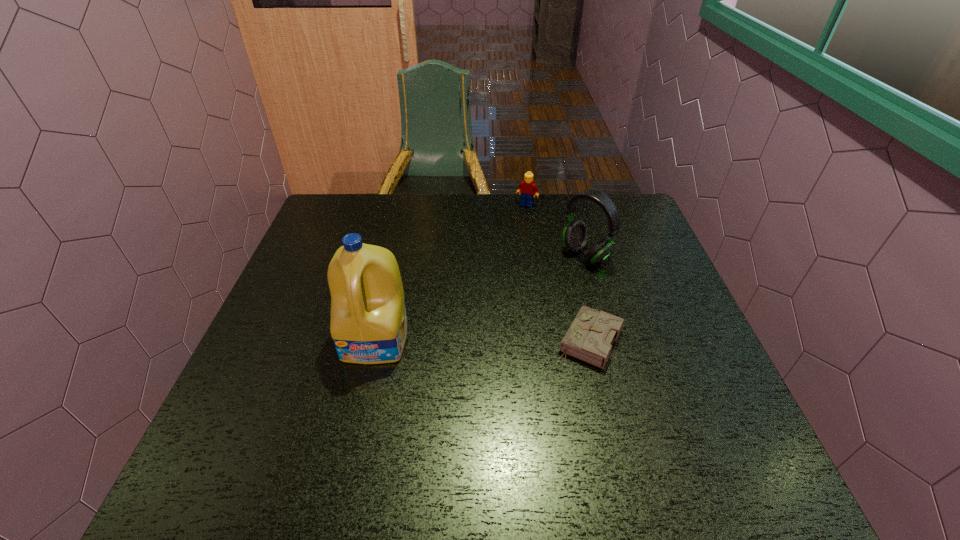
You are a GUI agent. You are given a task and a screenshot of the screen. Output one action in this format:
    pyautogui.click(x=<x>, y=<y>)
    Task: Click on the vacant area between the tallest object and the second shortest object
    This screenshot has height=540, width=960.
    Given the screenshot: What is the action you would take?
    pyautogui.click(x=451, y=272)

You are a GUI agent. You are given a task and a screenshot of the screen. Output one action in this format:
    pyautogui.click(x=<x>, y=<y>)
    Task: Click on the free space between the shortest object and the detergent
    The image size is (960, 540).
    Given the screenshot: What is the action you would take?
    pyautogui.click(x=483, y=340)

Where is `empty space that is in between the tallest object and the diary`? empty space that is in between the tallest object and the diary is located at coordinates (483, 340).

Where is `free space between the third nearest object and the Lego`? The width and height of the screenshot is (960, 540). free space between the third nearest object and the Lego is located at coordinates (556, 230).

Identify which object is located as the second nearest to the headset. Please provide its 2D coordinates. Your answer should be formatted as a tuple, i.e. [(x, y)], where the tuple contains the x and y coordinates of a point satisfying the conditions above.

[(527, 188)]

Locate which object ranks third in proximity to the headset. Please provide its 2D coordinates. Your answer should be formatted as a tuple, i.e. [(x, y)], where the tuple contains the x and y coordinates of a point satisfying the conditions above.

[(368, 324)]

Where is `vacant space that satisfies the following two spatial constraints: 1. on the label of the leftmost object; 2. on the left side of the diary`? Image resolution: width=960 pixels, height=540 pixels. vacant space that satisfies the following two spatial constraints: 1. on the label of the leftmost object; 2. on the left side of the diary is located at coordinates (376, 341).

I want to click on free space that satisfies the following two spatial constraints: 1. on the label of the tallest object; 2. on the right side of the diary, so click(376, 341).